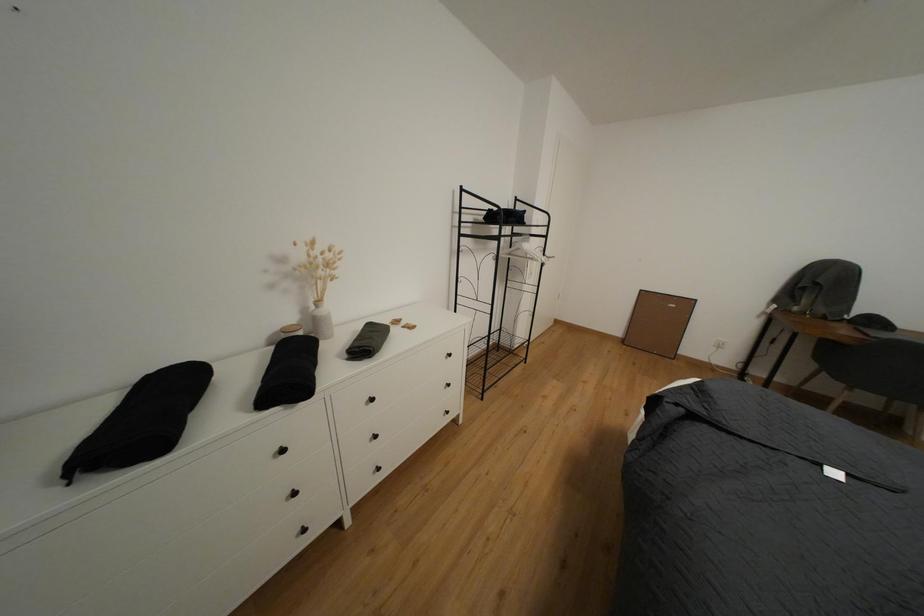
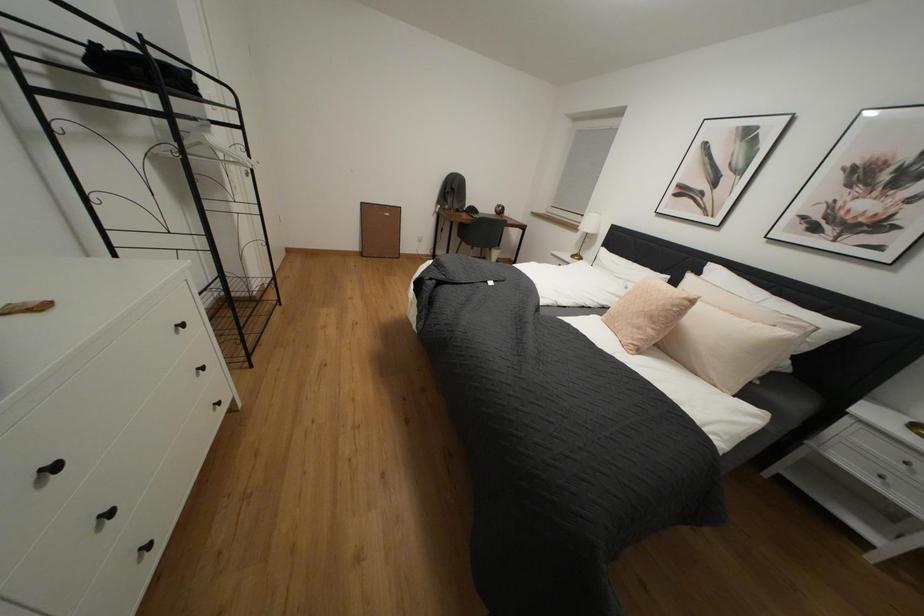
First-person continuous shooting, in which direction is the camera rotating?

The rotation direction of the camera is right-down.